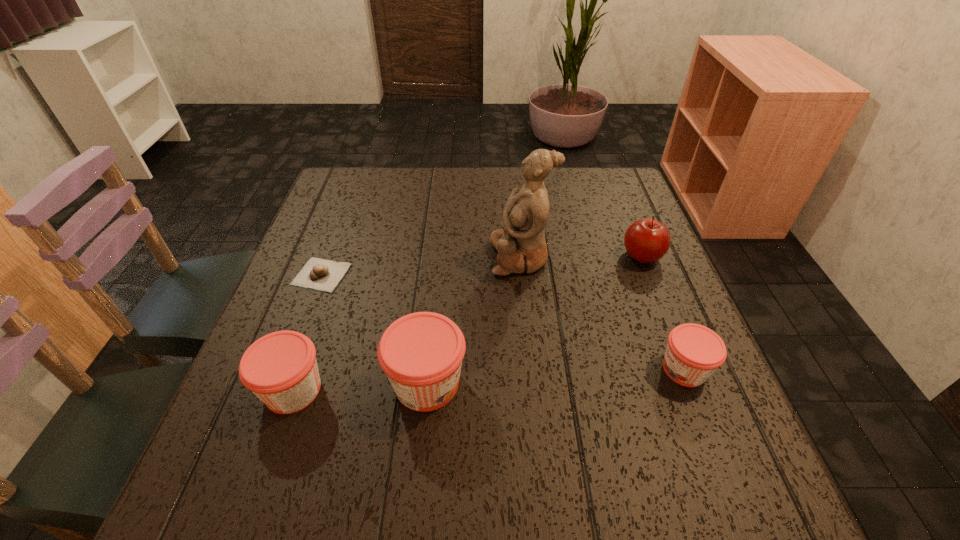
Locate an element on the screen. The height and width of the screenshot is (540, 960). jam that stands as the second closest to the second shortest object is located at coordinates (280, 368).

Identify which jam is located as the second nearest to the tallest object. Please provide its 2D coordinates. Your answer should be formatted as a tuple, i.e. [(x, y)], where the tuple contains the x and y coordinates of a point satisfying the conditions above.

[(694, 352)]

Find the location of a particular element. vacant region that satisfies the following two spatial constraints: 1. on the back side of the apple; 2. on the left side of the garlic is located at coordinates (328, 256).

Image resolution: width=960 pixels, height=540 pixels. I want to click on vacant space that satisfies the following two spatial constraints: 1. on the front side of the apple; 2. on the front label of the rightmost jam, so click(687, 369).